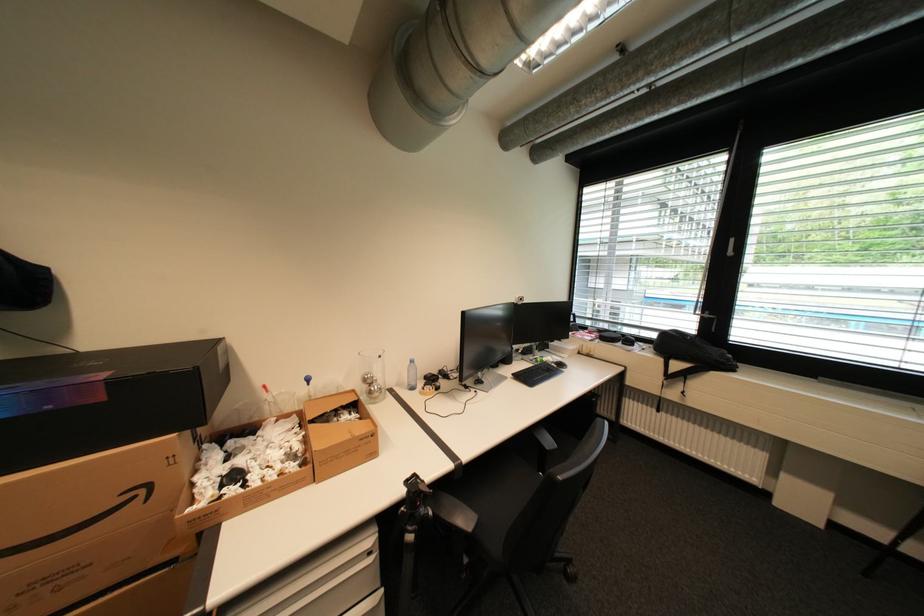
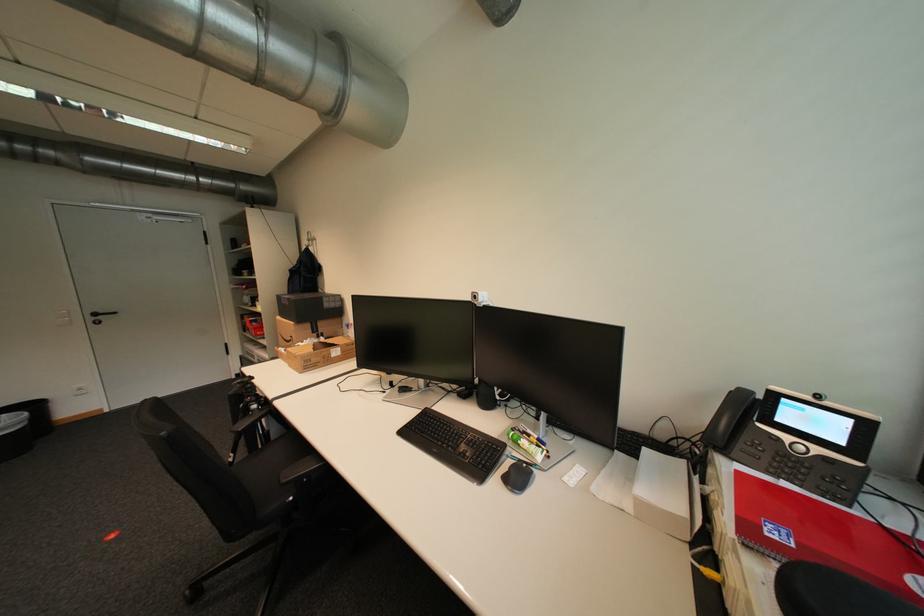
Where in the second image is the point corresponding to (x=113, y=400) from the first image?

(296, 305)